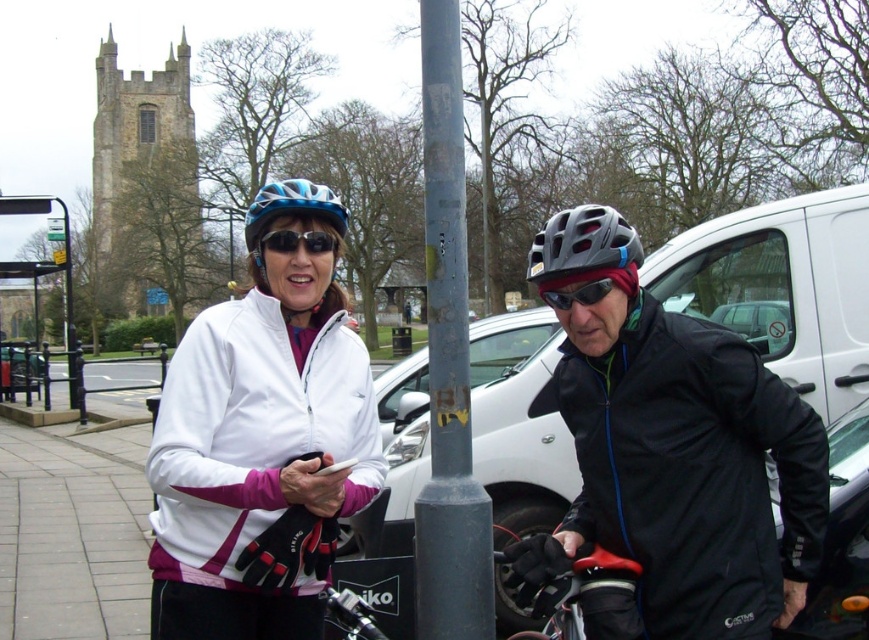
Can you confirm if blue matte bicycle helmet at center is positioned below metallic bus stop at left?

No.

Which is in front, point (322, 193) or point (50, 202)?

Point (322, 193) is more forward.

This screenshot has width=869, height=640. I want to click on blue matte bicycle helmet at center, so click(292, 208).

The height and width of the screenshot is (640, 869). Describe the element at coordinates (448, 362) in the screenshot. I see `gray metallic pole at center` at that location.

Between gray metallic pole at center and metallic bus stop at left, which one appears on the right side from the viewer's perspective?

From the viewer's perspective, gray metallic pole at center appears more on the right side.

Locate an element on the screen. The width and height of the screenshot is (869, 640). gray metallic pole at center is located at coordinates (448, 362).

Where is `gray metallic pole at center`? The width and height of the screenshot is (869, 640). gray metallic pole at center is located at coordinates (448, 362).

Can you confirm if matte black jacket at center is positioned below gray metallic pole at center?

Correct, matte black jacket at center is located below gray metallic pole at center.

Is matte black jacket at center positioned behind gray metallic pole at center?

That is True.

Between point (688, 454) and point (436, 140), which one is positioned in front?

Positioned in front is point (688, 454).

This screenshot has height=640, width=869. I want to click on matte black jacket at center, so click(672, 451).